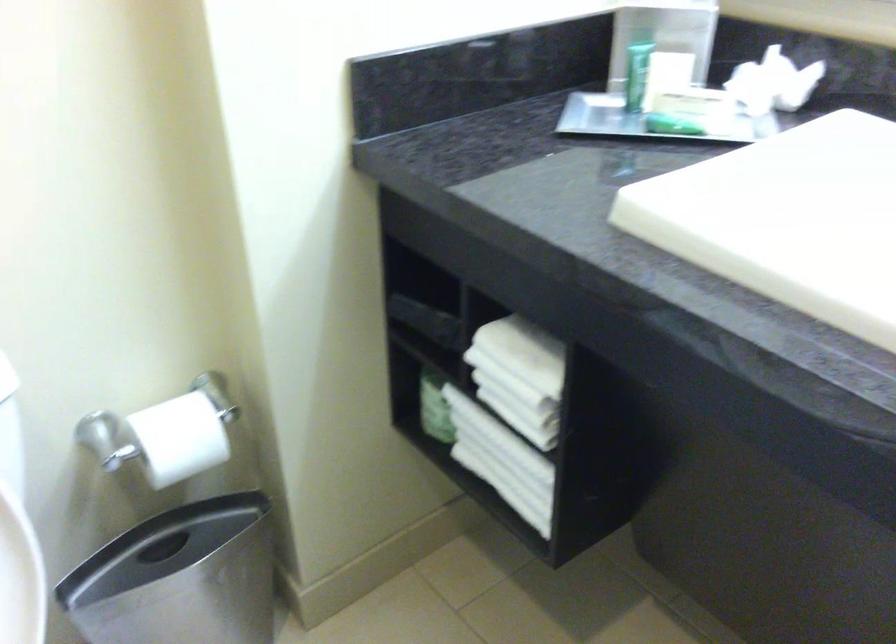
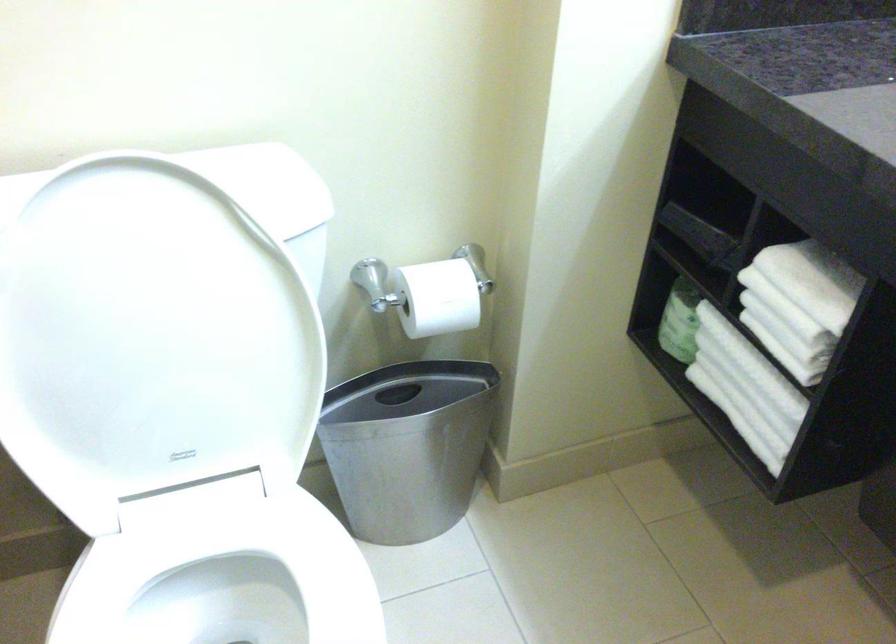
The point at (433, 406) is marked in the first image. Where is the corresponding point in the second image?

(679, 321)